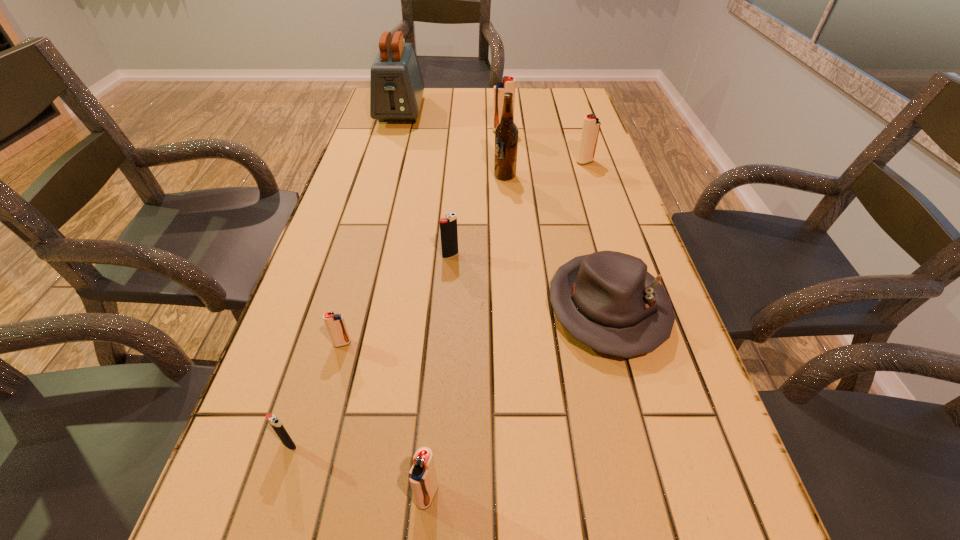
Where is `toaster`? toaster is located at coordinates (396, 85).

Identify the location of the sixth nearest object. (506, 132).

Find the location of a particular element. the tallest igniter is located at coordinates (508, 85).

I want to click on the farthest igniter, so click(x=508, y=85).

Find the location of `the rightmost igniter`. the rightmost igniter is located at coordinates (591, 125).

Identify the location of the seventh nearest object. (591, 125).

Where is `the bigger black igniter`? the bigger black igniter is located at coordinates (448, 226).

At what (x,y) coordinates should I click in order to perform the action: click on the fifth nearest object. Please return your answer as a coordinate pair (x, y). The height and width of the screenshot is (540, 960). Looking at the image, I should click on (448, 226).

In order to click on the nearest red igniter in this screenshot , I will do `click(422, 475)`.

Where is `the nearest igniter`? the nearest igniter is located at coordinates (422, 475).